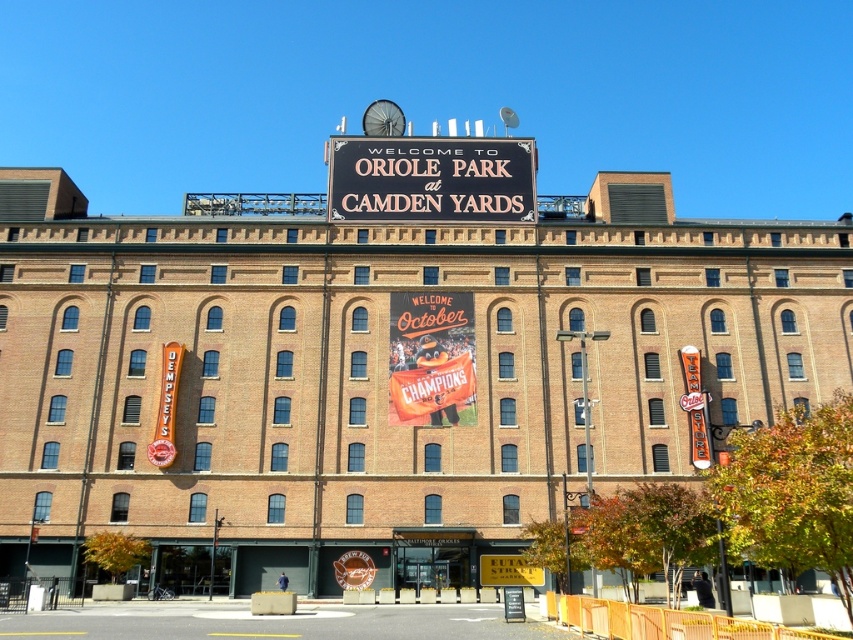
You are a visitor standing in front of Oriole Park at Camden Yards. You see the black matte sign at center and the orange fabric banner at center. Which one do you think is larger in size?

The black matte sign at center is bigger than the orange fabric banner at center, so the black matte sign at center is larger in size.

You are a visitor standing at the entrance of Oriole Park at Camden Yards. You notice two signs above you. The first is the black matte sign at center, and the second is the orange fabric banner at center. Which of these two signs is taller?

The black matte sign at center is much taller than the orange fabric banner at center.

Consider the image. You are a visitor standing at the entrance of Oriole Park at Camden Yards. You notice two signs above you. The first is the black matte sign at center, and the second is the orange fabric banner at center. Which of these two signs is wider?

The black matte sign at center is wider than the orange fabric banner at center.